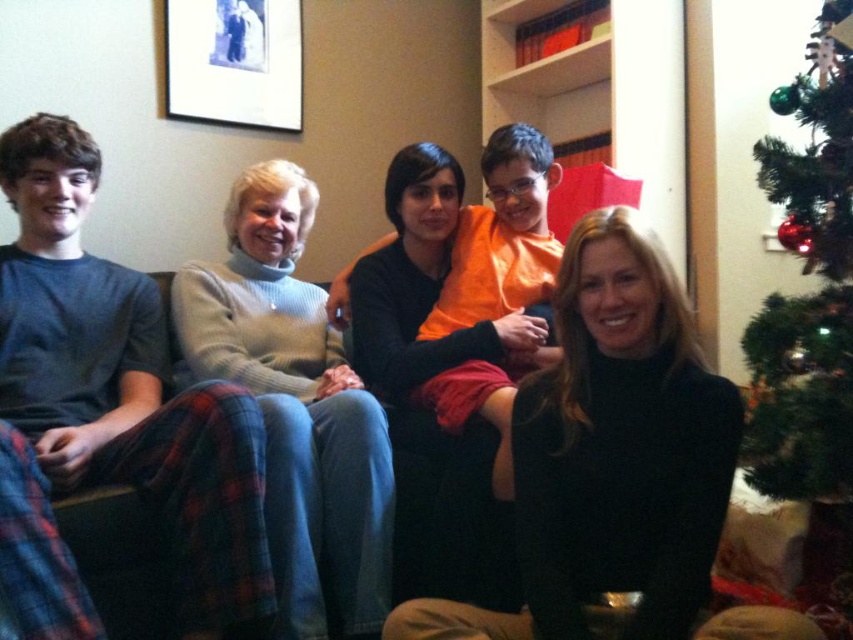
You are a delivery robot with a package that measures 20 inches in width. You need to navigate through the space between the black turtleneck sweater at center and the green artificial tree at right to reach the recipient. Can your package fit through this space?

The distance between the black turtleneck sweater at center and the green artificial tree at right is 21.17 inches. Since the package is 20 inches wide, it should fit through the space as there is enough clearance.

You are a photographer trying to capture a group photo of the people in the living room. You notice the matte black sweater at center and the black matte picture frame at upper left. Which object should you avoid blocking to ensure the subjects are clearly visible?

You should avoid blocking the matte black sweater at center because it is positioned on the right side of the black matte picture frame at upper left, so blocking the sweater would obscure the subjects behind it.

You are standing in the living room and want to reach the green artificial tree at right without moving the matte black sweater at center. Is this possible?

The matte black sweater at center is closer to the viewer than the green artificial tree at right, so you can reach the green artificial tree at right without moving the matte black sweater at center since it is farther away.